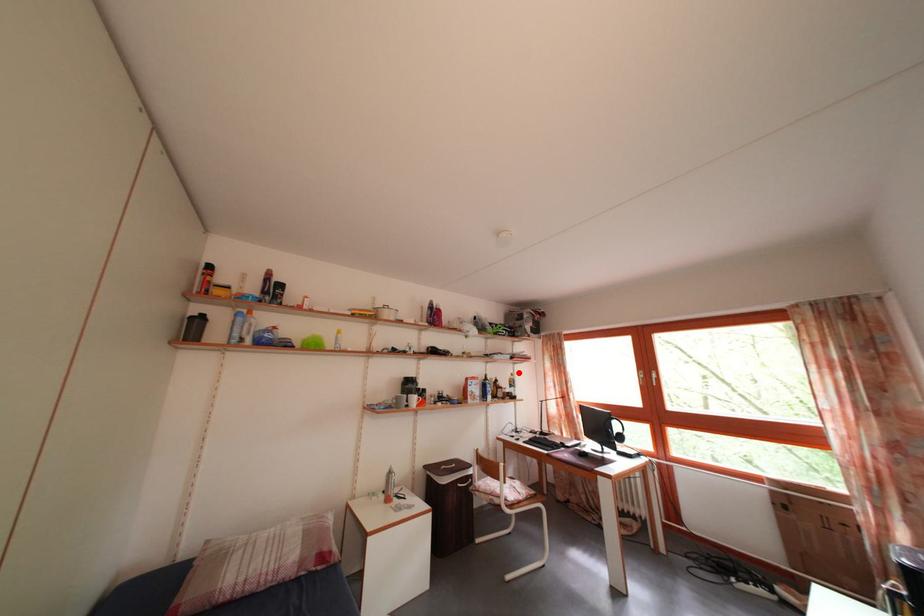
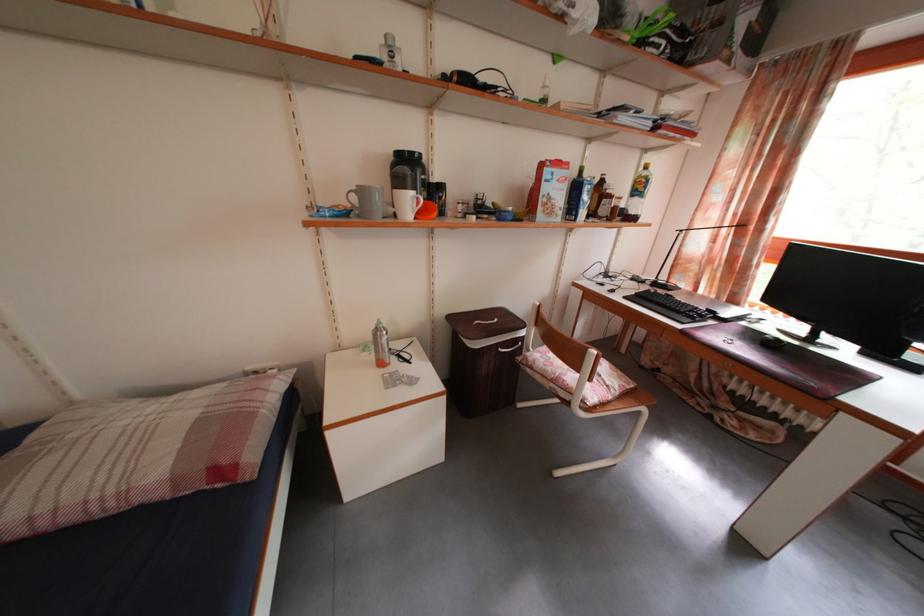
Question: I am providing you with two images of the same scene from different viewpoints. A red point is shown in image1. For the corresponding object point in image2, is it positioned nearer or farther from the camera?

Choices:
 (A) Nearer
 (B) Farther

Answer: (A)